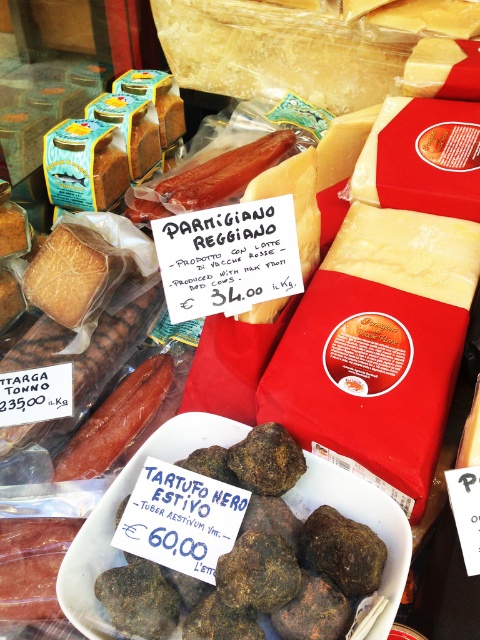
Question: Considering the relative positions of red-brown cured meat at center-left and smoked pinkish-red meat at center in the image provided, where is red-brown cured meat at center-left located with respect to smoked pinkish-red meat at center?

Choices:
 (A) right
 (B) left

Answer: (B)

Question: Considering the relative positions of brown rough truffle at lower center and smoked pinkish-red meat at center in the image provided, where is brown rough truffle at lower center located with respect to smoked pinkish-red meat at center?

Choices:
 (A) above
 (B) below

Answer: (B)

Question: Does red-brown cured meat at center-left come in front of smoked pinkish-red meat at center?

Choices:
 (A) yes
 (B) no

Answer: (A)

Question: Among these objects, which one is farthest from the camera?

Choices:
 (A) brown rough truffle at lower center
 (B) smoked pinkish-red meat at center
 (C) red-brown cured meat at center-left

Answer: (B)

Question: Among these objects, which one is nearest to the camera?

Choices:
 (A) smoked pinkish-red meat at center
 (B) red-brown cured meat at center-left

Answer: (B)

Question: Which object is closer to the camera taking this photo?

Choices:
 (A) smoked pinkish-red meat at center
 (B) brown rough truffle at lower center
 (C) red-brown cured meat at center-left

Answer: (B)